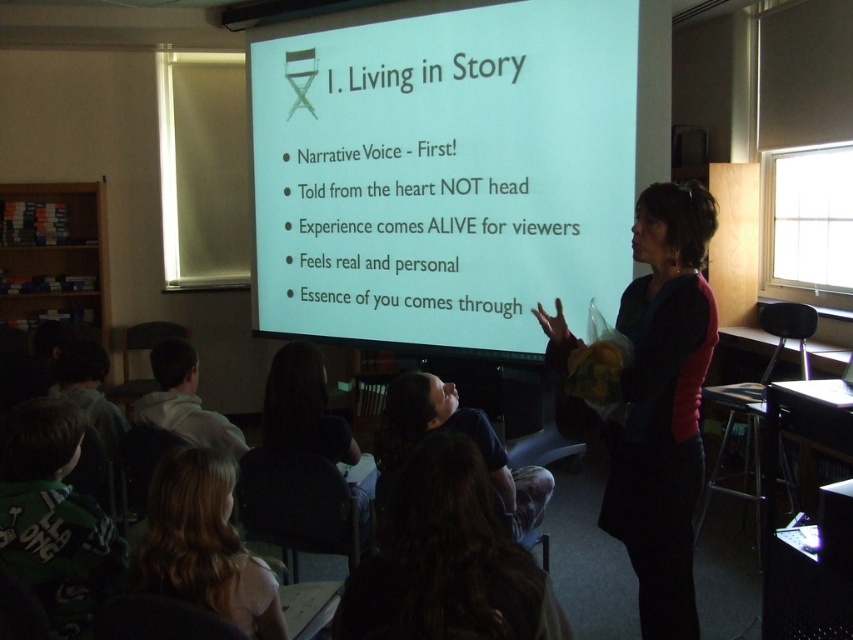
Question: Which point is farther to the camera?

Choices:
 (A) (402, 186)
 (B) (508, 582)
 (C) (189, 470)

Answer: (A)

Question: Does white matte projection screen at center appear over dark hair at lower center?

Choices:
 (A) yes
 (B) no

Answer: (A)

Question: Does dark blue sweater at center appear over dark hair at lower center?

Choices:
 (A) yes
 (B) no

Answer: (A)

Question: Where is dark blue sweater at center located in relation to dark hair at lower center in the image?

Choices:
 (A) below
 (B) above

Answer: (B)

Question: Among these objects, which one is farthest from the camera?

Choices:
 (A) blonde hair at lower left
 (B) dark hair at lower center

Answer: (B)

Question: Which of the following is the farthest from the observer?

Choices:
 (A) white matte projection screen at center
 (B) dark blue sweater at center
 (C) blonde hair at lower left
 (D) dark hair at lower center

Answer: (A)